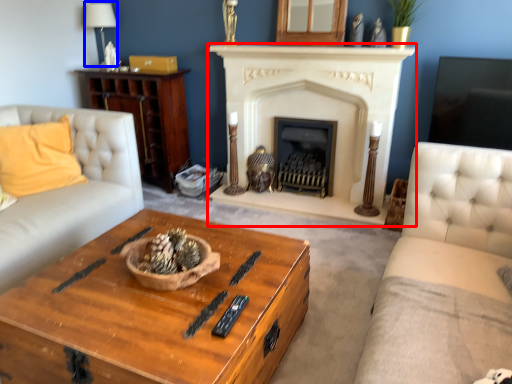
Question: Among these objects, which one is farthest to the camera, fireplace (highlighted by a red box) or lamp (highlighted by a blue box)?

Choices:
 (A) fireplace
 (B) lamp

Answer: (B)